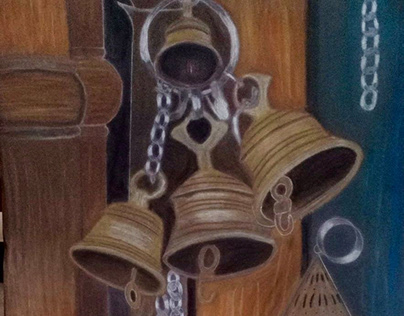
In order to click on door in this screenshot , I will do `click(71, 164)`.